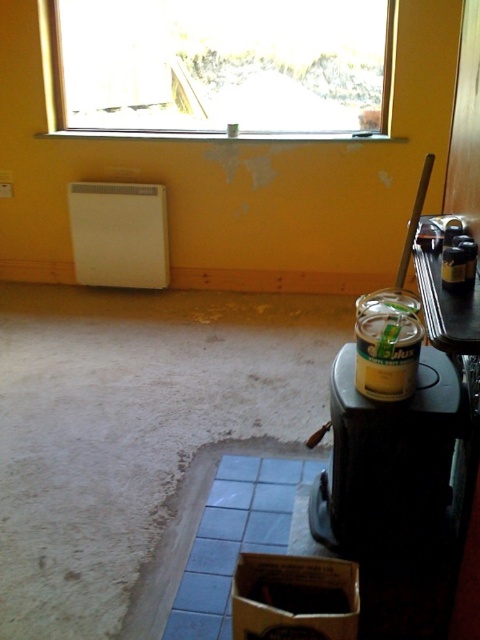
Question: Is transparent glass window at upper center below yellow matte paint can at lower right?

Choices:
 (A) no
 (B) yes

Answer: (A)

Question: Which point is farther from the camera taking this photo?

Choices:
 (A) (404, 445)
 (B) (302, 17)

Answer: (B)

Question: Is transparent glass window at upper center wider than yellow matte paint can at lower right?

Choices:
 (A) no
 (B) yes

Answer: (B)

Question: Which object is closer to the camera taking this photo?

Choices:
 (A) transparent glass window at upper center
 (B) yellow matte paint can at lower right

Answer: (B)

Question: Does transparent glass window at upper center have a greater width compared to yellow matte paint can at lower right?

Choices:
 (A) yes
 (B) no

Answer: (A)